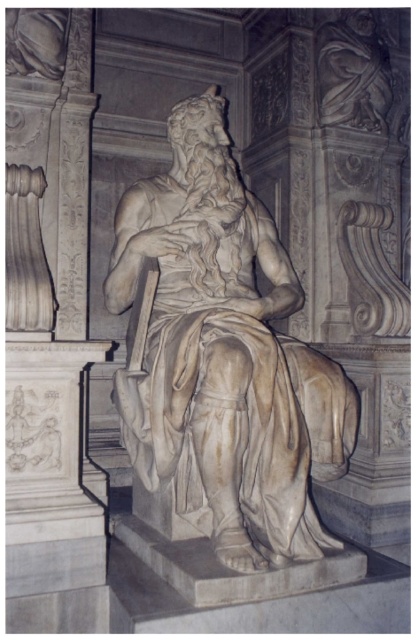
Question: Is the position of white marble statue at center less distant than that of marble carving at upper center?

Choices:
 (A) yes
 (B) no

Answer: (A)

Question: Can you confirm if white marble statue at center is positioned to the right of marble carving at upper center?

Choices:
 (A) no
 (B) yes

Answer: (A)

Question: Which point is farther from the camera taking this photo?

Choices:
 (A) (316, 352)
 (B) (339, 83)

Answer: (B)

Question: Which point appears farthest from the camera in this image?

Choices:
 (A) (323, 52)
 (B) (188, 241)

Answer: (A)

Question: Is white marble statue at center bigger than marble carving at upper center?

Choices:
 (A) yes
 (B) no

Answer: (A)